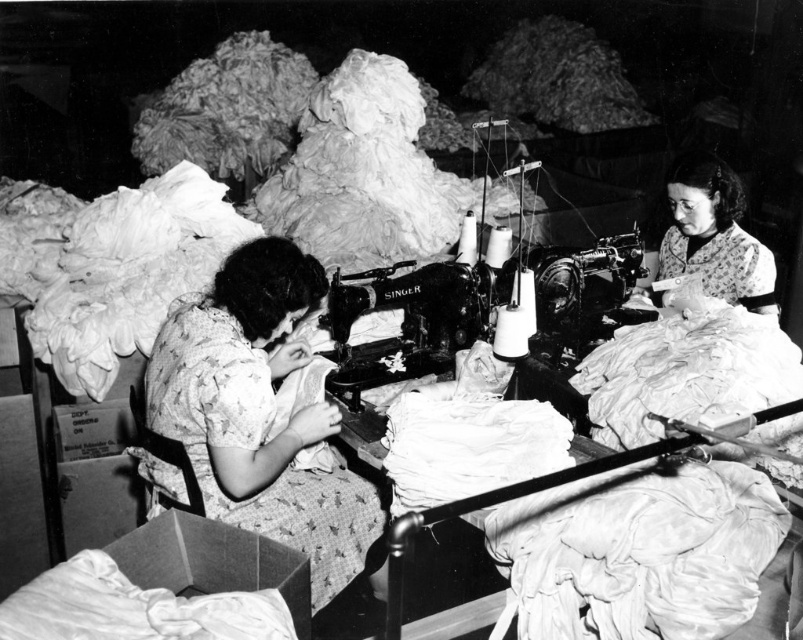
Question: From the image, what is the correct spatial relationship of floral fabric dress at center in relation to floral fabric dress at upper right?

Choices:
 (A) left
 (B) right

Answer: (A)

Question: Is floral fabric dress at center bigger than floral fabric dress at upper right?

Choices:
 (A) no
 (B) yes

Answer: (B)

Question: Does floral fabric dress at center appear over floral fabric dress at upper right?

Choices:
 (A) no
 (B) yes

Answer: (A)